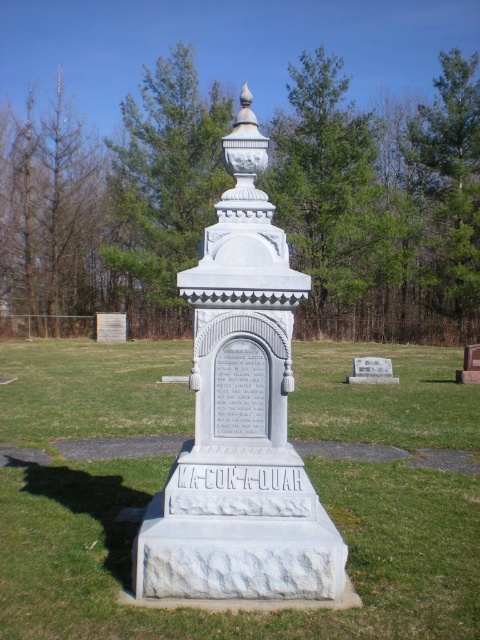
Which is in front, point (87, 349) or point (276, 579)?

Point (276, 579)

Image resolution: width=480 pixels, height=640 pixels. What do you see at coordinates (240, 612) in the screenshot?
I see `green grass at center` at bounding box center [240, 612].

Image resolution: width=480 pixels, height=640 pixels. What do you see at coordinates (240, 612) in the screenshot?
I see `green grass at center` at bounding box center [240, 612].

Locate an element on the screen. green grass at center is located at coordinates (240, 612).